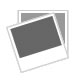
At what (x,y) coordinates should I click in order to perform the action: click on corner. Please return your answer as a coordinate pair (x, y). Looking at the image, I should click on (54, 12).